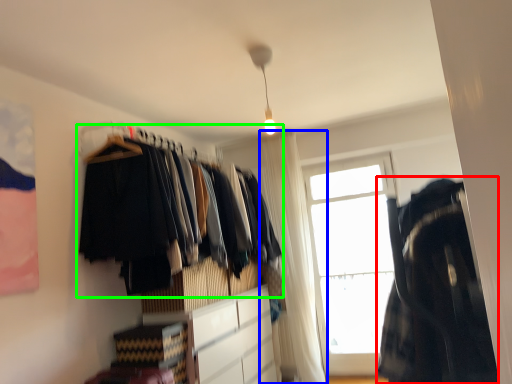
Question: Which is nearer to the clothing (highlighted by a red box)? curtain (highlighted by a blue box) or closet (highlighted by a green box).

Choices:
 (A) curtain
 (B) closet

Answer: (B)